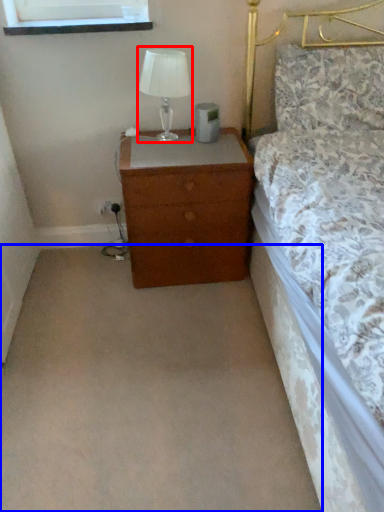
Question: Which of the following is the closest to the observer, table lamp (highlighted by a red box) or plain (highlighted by a blue box)?

Choices:
 (A) table lamp
 (B) plain

Answer: (B)